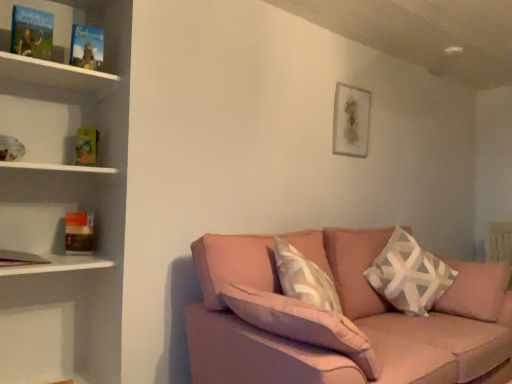
Question: Is yellow paper at left, positioned as the fourth paperback book in front-to-back order, facing away from hardcover book at left, the 4th paperback book positioned from the top?

Choices:
 (A) yes
 (B) no

Answer: (B)

Question: From the image's perspective, would you say yellow paper at left, positioned as the fourth paperback book in front-to-back order, is shown under hardcover book at left, which is the 2th paperback book from back to front?

Choices:
 (A) no
 (B) yes

Answer: (A)

Question: From a real-world perspective, is yellow paper at left, which is counted as the third paperback book, starting from the top, on top of hardcover book at left, which is the 2th paperback book from back to front?

Choices:
 (A) no
 (B) yes

Answer: (B)

Question: Can you confirm if yellow paper at left, the 2th paperback book when ordered from bottom to top, is thinner than hardcover book at left, which ranks as the 1th paperback book in bottom-to-top order?

Choices:
 (A) no
 (B) yes

Answer: (B)

Question: Is yellow paper at left, the 1th paperback book in the back-to-front sequence, facing towards hardcover book at left, which is the 2th paperback book from back to front?

Choices:
 (A) no
 (B) yes

Answer: (A)

Question: From a real-world perspective, is white wooden shelf at left physically located above or below yellow paper at left, the 1th paperback book in the back-to-front sequence?

Choices:
 (A) above
 (B) below

Answer: (B)

Question: Considering the positions of white wooden shelf at left and yellow paper at left, which is counted as the third paperback book, starting from the top, in the image, is white wooden shelf at left taller or shorter than yellow paper at left, which is counted as the third paperback book, starting from the top,?

Choices:
 (A) short
 (B) tall

Answer: (A)

Question: In the image, is white wooden shelf at left on the left side or the right side of yellow paper at left, which is counted as the third paperback book, starting from the top?

Choices:
 (A) right
 (B) left

Answer: (B)

Question: Considering the positions of point (99, 173) and point (93, 132), is point (99, 173) closer or farther from the camera than point (93, 132)?

Choices:
 (A) closer
 (B) farther

Answer: (A)

Question: Is hardcover book at upper left, which appears as the 2th paperback book when viewed from the top, wider or thinner than hardcover book at left, arranged as the third paperback book when viewed from the front?

Choices:
 (A) thin
 (B) wide

Answer: (A)

Question: Is hardcover book at upper left, the 3th paperback book viewed from the back, to the left or to the right of hardcover book at left, which ranks as the 1th paperback book in bottom-to-top order, in the image?

Choices:
 (A) left
 (B) right

Answer: (B)

Question: Considering the positions of hardcover book at upper left, the third paperback book in the bottom-to-top sequence, and hardcover book at left, arranged as the third paperback book when viewed from the front, in the image, is hardcover book at upper left, the third paperback book in the bottom-to-top sequence, taller or shorter than hardcover book at left, arranged as the third paperback book when viewed from the front,?

Choices:
 (A) short
 (B) tall

Answer: (B)

Question: Does point (81, 59) appear closer or farther from the camera than point (81, 228)?

Choices:
 (A) farther
 (B) closer

Answer: (B)

Question: From a real-world perspective, is hardcover book at left, the 4th paperback book positioned from the top, physically located above or below white geometric-patterned pillow at right?

Choices:
 (A) above
 (B) below

Answer: (A)

Question: In terms of height, does hardcover book at left, the 4th paperback book positioned from the top, look taller or shorter compared to white geometric-patterned pillow at right?

Choices:
 (A) short
 (B) tall

Answer: (A)